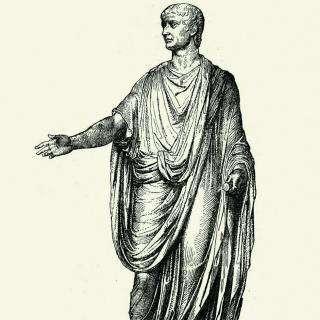
Locate an element on the screen. statue is located at coordinates (161, 111).